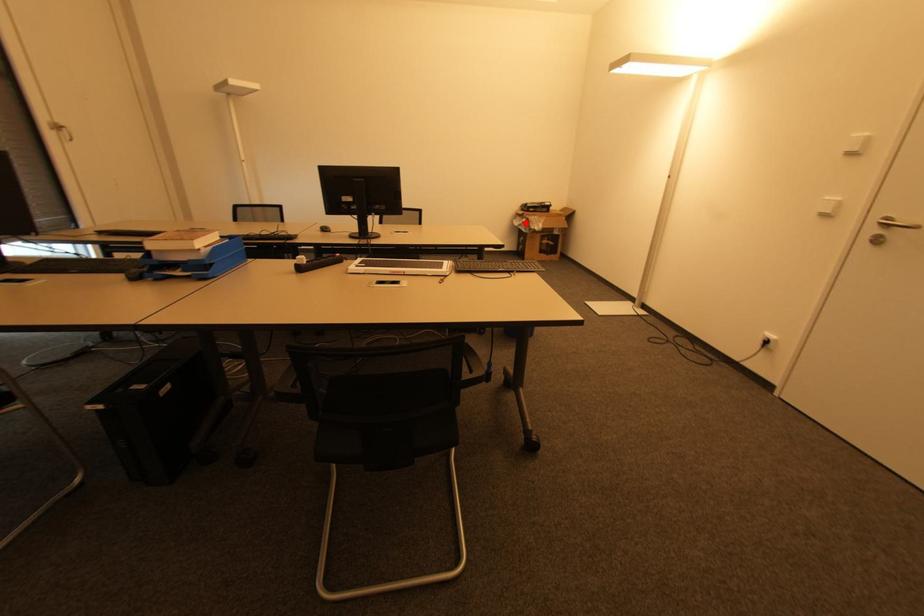
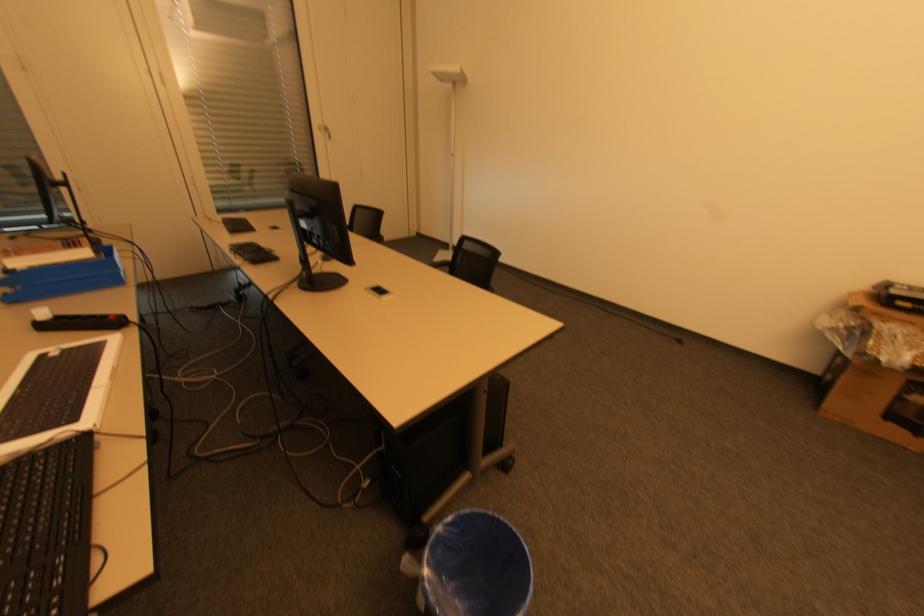
Question: I am providing you with two images of the same scene from different viewpoints. Given a red point in image1, look at the same physical point in image2. Is it:

Choices:
 (A) Closer to the viewpoint
 (B) Farther from the viewpoint

Answer: (B)